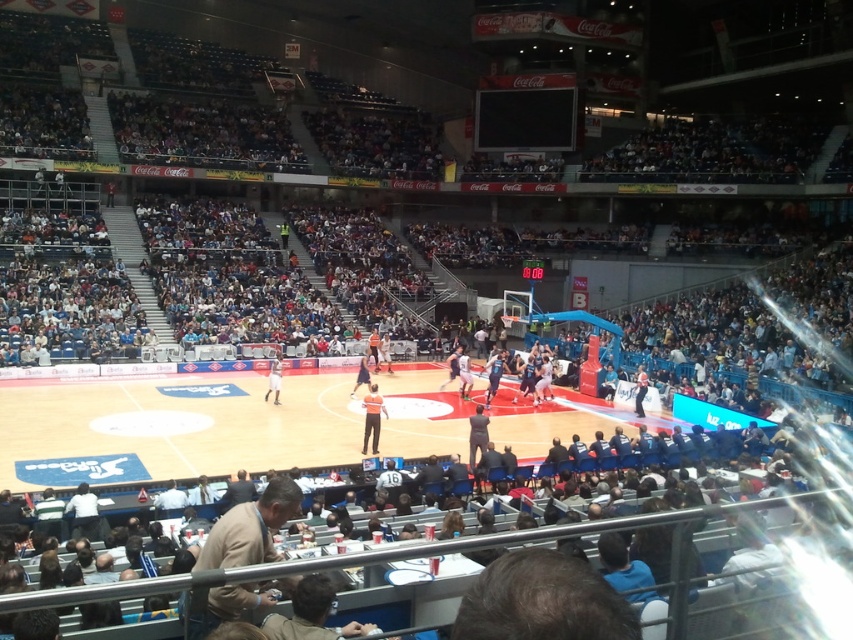
Which of these two, white jersey at center or smooth black basketball at center, stands taller?

smooth black basketball at center

Can you confirm if white jersey at center is smaller than smooth black basketball at center?

Incorrect, white jersey at center is not smaller in size than smooth black basketball at center.

Which is behind, point (276, 380) or point (354, 388)?

The point (354, 388) is behind.

At what (x,y) coordinates should I click in order to perform the action: click on white jersey at center. Please return your answer as a coordinate pair (x, y). The height and width of the screenshot is (640, 853). Looking at the image, I should click on (274, 378).

Which is below, tan leather jacket at lower left or orange uniform at center?

orange uniform at center

Can you confirm if tan leather jacket at lower left is positioned below orange uniform at center?

Actually, tan leather jacket at lower left is above orange uniform at center.

Find the location of a particular element. The width and height of the screenshot is (853, 640). tan leather jacket at lower left is located at coordinates (250, 528).

Identify the location of tan leather jacket at lower left. (250, 528).

Consider the image. Which of these two, wooden basketball court at center or tan leather jacket at lower left, stands taller?

Standing taller between the two is wooden basketball court at center.

From the picture: Is wooden basketball court at center below tan leather jacket at lower left?

Correct, wooden basketball court at center is located below tan leather jacket at lower left.

Is point (598, 417) positioned before point (221, 524)?

No, (598, 417) is further to viewer.

You are a GUI agent. You are given a task and a screenshot of the screen. Output one action in this format:
    pyautogui.click(x=<x>, y=<y>)
    Task: Click on the wooden basketball court at center
    This screenshot has height=640, width=853.
    Given the screenshot: What is the action you would take?
    pyautogui.click(x=178, y=422)